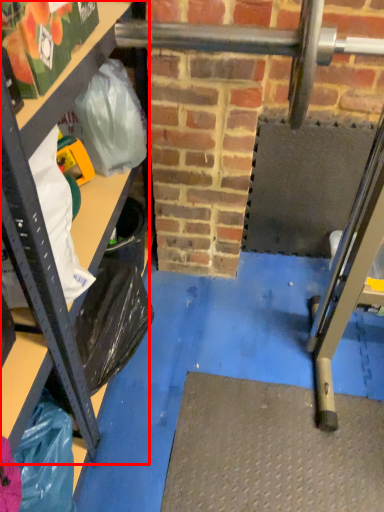
Question: From the image's perspective, where is shelf (annotated by the red box) located in relation to grocery bag in the image?

Choices:
 (A) below
 (B) above

Answer: (B)